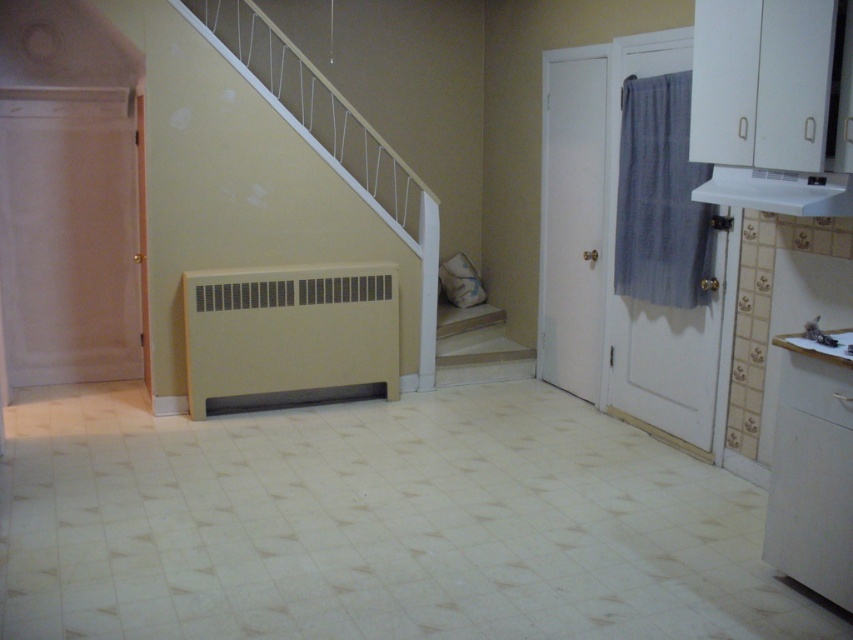
Who is shorter, beige matte radiator at lower center or wooden staircase at center?

wooden staircase at center is shorter.

In the scene shown: Which is above, beige matte radiator at lower center or wooden staircase at center?

beige matte radiator at lower center is higher up.

Identify the location of beige matte radiator at lower center. This screenshot has width=853, height=640. (289, 330).

Find the location of a particular element. Image resolution: width=853 pixels, height=640 pixels. beige matte radiator at lower center is located at coordinates (289, 330).

This screenshot has width=853, height=640. What do you see at coordinates (811, 472) in the screenshot?
I see `white matte dishwasher at lower right` at bounding box center [811, 472].

At what (x,y) coordinates should I click in order to perform the action: click on white matte dishwasher at lower right. Please return your answer as a coordinate pair (x, y). Looking at the image, I should click on (811, 472).

Can you confirm if beige matte radiator at lower center is positioned above white matte dishwasher at lower right?

Indeed, beige matte radiator at lower center is positioned over white matte dishwasher at lower right.

Who is shorter, beige matte radiator at lower center or white matte dishwasher at lower right?

Standing shorter between the two is beige matte radiator at lower center.

This screenshot has width=853, height=640. I want to click on beige matte radiator at lower center, so click(x=289, y=330).

Where is `beige matte radiator at lower center`? beige matte radiator at lower center is located at coordinates (289, 330).